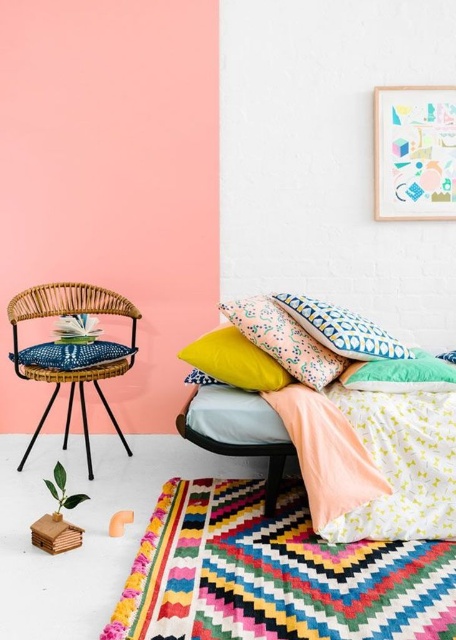
You are standing in the bedroom corner and want to hang a new painting. The wooden picture frame at upper right has a point at coordinates point (414, 152). If you want to hang your new painting exactly where that point is, will it be on the wooden picture frame at upper right?

Yes, the point (414, 152) is on the wooden picture frame at upper right, so hanging the new painting there would place it directly on the wooden picture frame at upper right.

You are standing in the bedroom corner and want to place a new decorative item on the blue patterned pillow at center. Based on the room layout, can you confirm if this location is centrally positioned in the room?

The blue patterned pillow at center is located at point (x=342, y=330), which is very close to the center coordinates of the room, so yes, it is centrally positioned.

You are arranging a photo album on your desk and need to place the wooden picture frame at upper right and the yellow matte pillow at center. According to the scene, which object is located to the right of the other?

The wooden picture frame at upper right is positioned on the right side of yellow matte pillow at center.